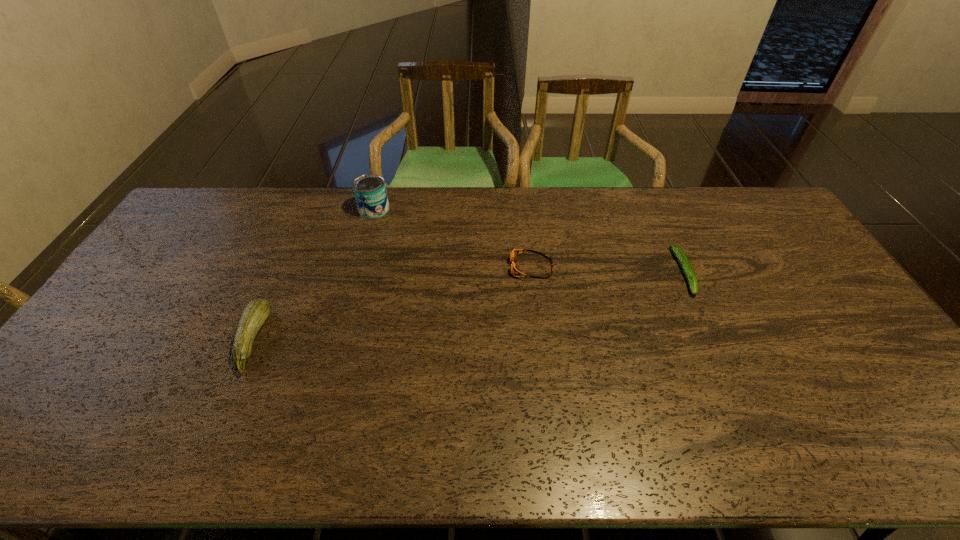
Where is `can`? This screenshot has height=540, width=960. can is located at coordinates (370, 192).

I want to click on the farthest object, so click(x=370, y=192).

At what (x,y) coordinates should I click in order to perform the action: click on the nearest object. Please return your answer as a coordinate pair (x, y). This screenshot has height=540, width=960. Looking at the image, I should click on (256, 313).

Where is `the taller zucchini`? the taller zucchini is located at coordinates (256, 313).

Identify the location of the second shortest object. The width and height of the screenshot is (960, 540). (515, 269).

I want to click on the third object from left to right, so click(515, 269).

The image size is (960, 540). Find the location of `the farther zucchini`. the farther zucchini is located at coordinates (686, 266).

Find the location of a particular element. the shortest object is located at coordinates (x=686, y=266).

In order to click on free space located on the front of the tallest object in this screenshot , I will do `click(354, 283)`.

I want to click on free space located 0.090m at the stem end of the left zucchini, so click(298, 340).